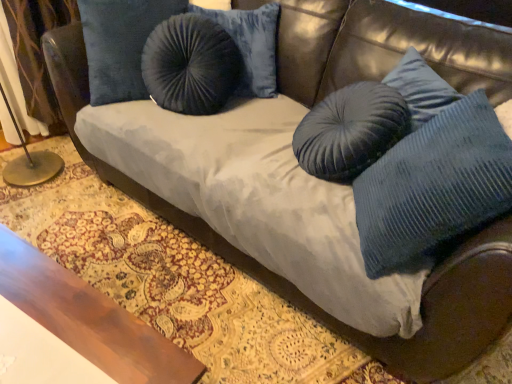
Question: Is velvet curtain at left surrounded by wooden table at lower left?

Choices:
 (A) yes
 (B) no

Answer: (B)

Question: Is velvet curtain at left at the back of wooden table at lower left?

Choices:
 (A) no
 (B) yes

Answer: (A)

Question: Is wooden table at lower left at the right side of velvet curtain at left?

Choices:
 (A) yes
 (B) no

Answer: (A)

Question: Is there a large distance between wooden table at lower left and velvet curtain at left?

Choices:
 (A) yes
 (B) no

Answer: (A)

Question: Can you confirm if wooden table at lower left is bigger than velvet curtain at left?

Choices:
 (A) no
 (B) yes

Answer: (B)

Question: Is wooden table at lower left wider or thinner than velvet curtain at left?

Choices:
 (A) wide
 (B) thin

Answer: (A)

Question: Considering their positions, is wooden table at lower left located in front of or behind velvet curtain at left?

Choices:
 (A) front
 (B) behind

Answer: (A)

Question: Is point (31, 274) closer or farther from the camera than point (17, 14)?

Choices:
 (A) closer
 (B) farther

Answer: (A)

Question: Based on their sizes in the image, would you say wooden table at lower left is bigger or smaller than velvet curtain at left?

Choices:
 (A) small
 (B) big

Answer: (B)

Question: Looking at the image, does wooden table at lower left seem bigger or smaller compared to blue corduroy pillow at right?

Choices:
 (A) small
 (B) big

Answer: (B)

Question: Is wooden table at lower left in front of or behind blue corduroy pillow at right in the image?

Choices:
 (A) behind
 (B) front

Answer: (B)

Question: From a real-world perspective, is wooden table at lower left above or below blue corduroy pillow at right?

Choices:
 (A) above
 (B) below

Answer: (B)

Question: From the image's perspective, is wooden table at lower left located above or below blue corduroy pillow at right?

Choices:
 (A) below
 (B) above

Answer: (A)

Question: In the image, is blue corduroy pillow at right positioned in front of or behind wooden table at lower left?

Choices:
 (A) front
 (B) behind

Answer: (B)

Question: Is point (398, 160) positioned closer to the camera than point (15, 294)?

Choices:
 (A) farther
 (B) closer

Answer: (A)